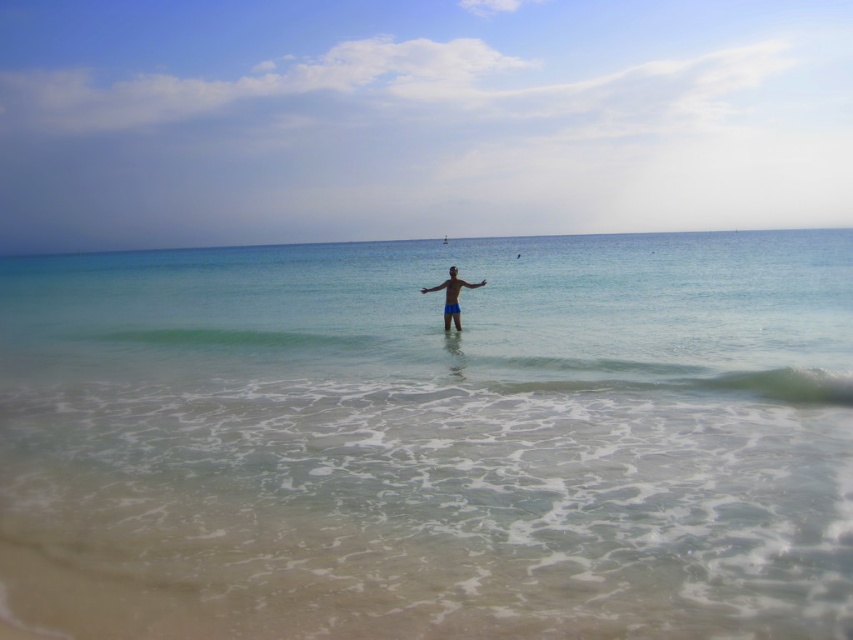
Question: Observing the image, what is the correct spatial positioning of clear blue water at center in reference to blue matte shorts at center?

Choices:
 (A) above
 (B) below

Answer: (A)

Question: Where is clear blue water at center located in relation to blue matte shorts at center in the image?

Choices:
 (A) below
 (B) above

Answer: (B)

Question: Is clear blue water at center closer to camera compared to blue matte shorts at center?

Choices:
 (A) yes
 (B) no

Answer: (A)

Question: Which of the following is the closest to the observer?

Choices:
 (A) clear blue water at center
 (B) blue matte shorts at center

Answer: (A)